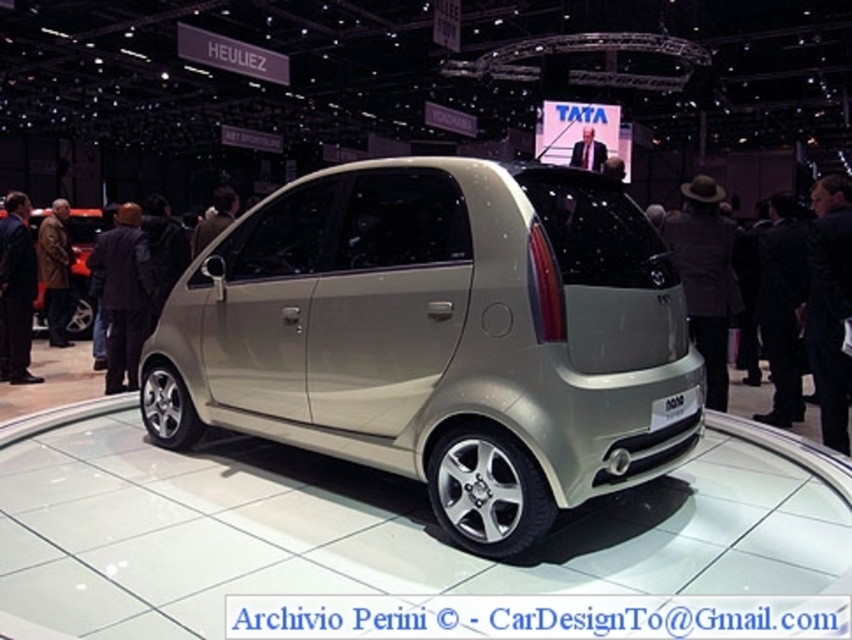
You are a delivery person with a 20 feet long truck that needs to park between the satin beige minivan at center and the matte silver car at left. Can your truck fit in the space between them?

The distance between the satin beige minivan at center and the matte silver car at left is 25.49 feet. Since the truck is 20 feet long, it can fit in the space between them as there is enough room.

You are a photographer standing at the camera position. You need to capture a closeup shot of the satin beige minivan at center. The minimum focusing distance of your camera is 6 feet. Can you take the photo without moving closer?

The satin beige minivan at center is 7.50 feet from camera. Since the minimum focusing distance is 6 feet, the photographer can take the photo without moving closer as the distance is sufficient.

From the picture: You are standing at the entrance of the exhibition hall and see the car on its rotating platform. There are two points marked on the floor near the car. The first point is at coordinate point(x=289, y=365) and the second point is at coordinate point(x=35, y=308). If you want to approach the car from the front, which point should you stand on?

You should stand on point(x=289, y=365) because it is in front of point(x=35, y=308), which would give you a better view of the car from the front.